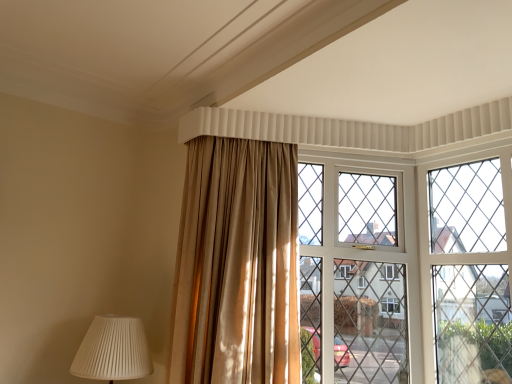
Question: Is white pleated lampshade at lower left turned away from clear glass window at center?

Choices:
 (A) no
 (B) yes

Answer: (A)

Question: Does white pleated lampshade at lower left have a lesser height compared to clear glass window at center?

Choices:
 (A) no
 (B) yes

Answer: (B)

Question: Is white pleated lampshade at lower left taller than clear glass window at center?

Choices:
 (A) no
 (B) yes

Answer: (A)

Question: Considering the relative sizes of white pleated lampshade at lower left and clear glass window at center in the image provided, is white pleated lampshade at lower left smaller than clear glass window at center?

Choices:
 (A) no
 (B) yes

Answer: (B)

Question: Would you say white pleated lampshade at lower left contains clear glass window at center?

Choices:
 (A) no
 (B) yes

Answer: (A)

Question: From their relative heights in the image, would you say clear glass window at center is taller or shorter than white pleated lampshade at lower left?

Choices:
 (A) short
 (B) tall

Answer: (B)

Question: From a real-world perspective, relative to white pleated lampshade at lower left, is clear glass window at center vertically above or below?

Choices:
 (A) below
 (B) above

Answer: (B)

Question: Which is correct: clear glass window at center is inside white pleated lampshade at lower left, or outside of it?

Choices:
 (A) inside
 (B) outside

Answer: (B)

Question: Looking at the image, does clear glass window at center seem bigger or smaller compared to white pleated lampshade at lower left?

Choices:
 (A) big
 (B) small

Answer: (A)

Question: Is satin gold curtain at center wider or thinner than clear glass window at center?

Choices:
 (A) thin
 (B) wide

Answer: (B)

Question: In terms of height, does satin gold curtain at center look taller or shorter compared to clear glass window at center?

Choices:
 (A) tall
 (B) short

Answer: (B)

Question: In the image, is satin gold curtain at center positioned in front of or behind clear glass window at center?

Choices:
 (A) behind
 (B) front

Answer: (B)

Question: From the image's perspective, is satin gold curtain at center above or below clear glass window at center?

Choices:
 (A) above
 (B) below

Answer: (A)

Question: From the image's perspective, relative to satin gold curtain at center, is clear glass window at center above or below?

Choices:
 (A) below
 (B) above

Answer: (A)

Question: Based on their sizes in the image, would you say clear glass window at center is bigger or smaller than satin gold curtain at center?

Choices:
 (A) small
 (B) big

Answer: (A)